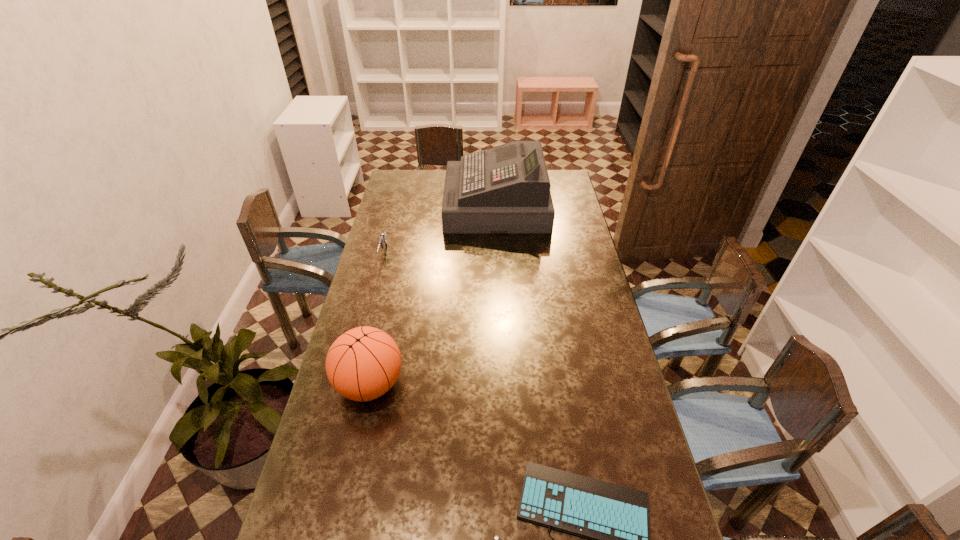
Where is `vacant space that satisfies the following two spatial constraints: 1. at the barrel of the second shortest object; 2. on the right side of the basketball`? vacant space that satisfies the following two spatial constraints: 1. at the barrel of the second shortest object; 2. on the right side of the basketball is located at coordinates (350, 384).